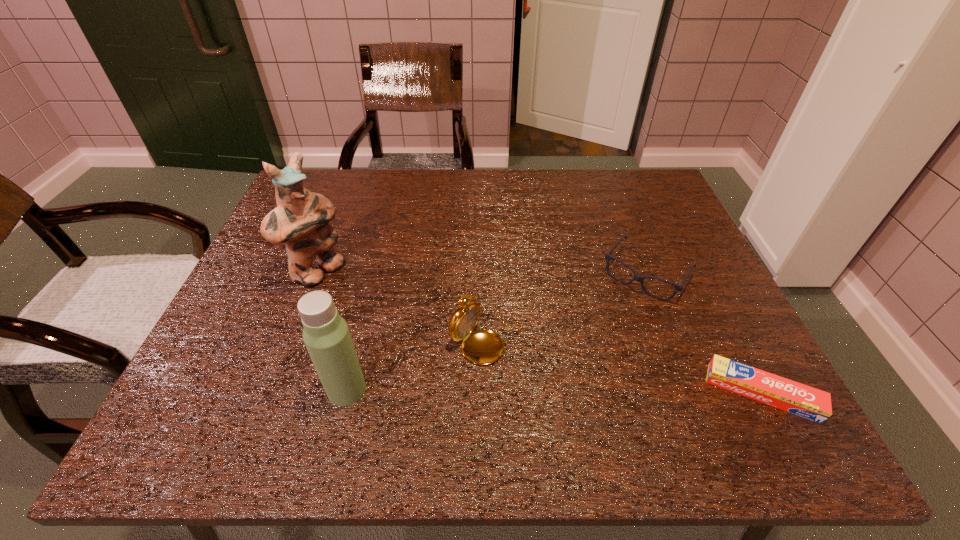
This screenshot has width=960, height=540. Identify the location of pocket watch that is at the near edge. (482, 346).

Locate an element on the screen. This screenshot has width=960, height=540. object situated at the left edge is located at coordinates (301, 219).

Where is `toothpaste that is positioned at the right edge`? toothpaste that is positioned at the right edge is located at coordinates (779, 392).

This screenshot has height=540, width=960. Identify the location of spectacles located at the right edge. point(638,278).

Where is `object that is positioned at the near right corner`? object that is positioned at the near right corner is located at coordinates click(x=779, y=392).

Locate an element on the screen. This screenshot has height=540, width=960. free space at the far edge is located at coordinates (544, 176).

I want to click on free space at the near edge of the desktop, so click(x=392, y=388).

Locate an element on the screen. Image resolution: width=960 pixels, height=540 pixels. vacant space at the right edge of the desktop is located at coordinates (739, 347).

Find the location of `free space at the near left corner`. free space at the near left corner is located at coordinates (212, 382).

Find the location of a particular element. The width and height of the screenshot is (960, 540). vacant space at the far right corner is located at coordinates (659, 206).